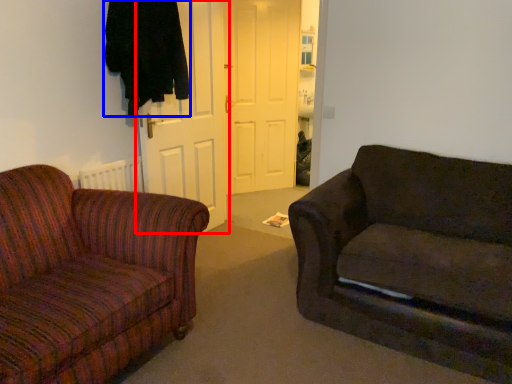
Question: Which point is closer to the camera, door (highlighted by a red box) or clothing (highlighted by a blue box)?

Choices:
 (A) door
 (B) clothing

Answer: (B)